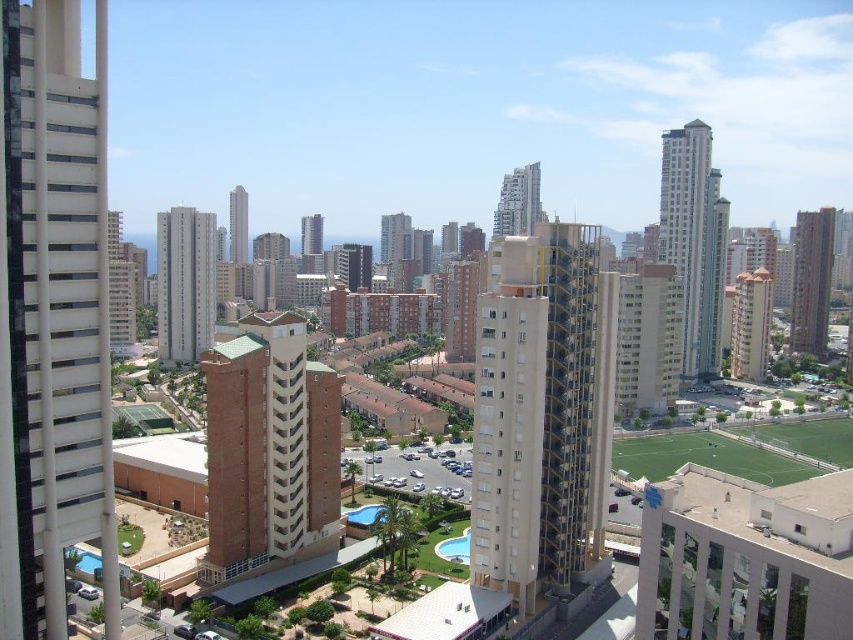
Is white textured building at left smaller than blue glass pool at center?

Incorrect, white textured building at left is not smaller in size than blue glass pool at center.

Between point (28, 321) and point (375, 520), which one is positioned in front?

Positioned in front is point (28, 321).

Who is more forward, (4, 10) or (387, 508)?

Point (4, 10) is more forward.

The width and height of the screenshot is (853, 640). What are the coordinates of `white textured building at left` in the screenshot? It's located at (x=51, y=316).

Is white textured building at left bigger than brick textured building at center?

Actually, white textured building at left might be smaller than brick textured building at center.

In the scene shown: Is white textured building at left in front of brick textured building at center?

Yes.

Is point (24, 38) more distant than point (239, 234)?

No, (24, 38) is closer to viewer.

This screenshot has width=853, height=640. What are the coordinates of `white textured building at left` in the screenshot? It's located at (51, 316).

Can you confirm if beige textured building at center is taller than light brown brick building at left?

Incorrect, beige textured building at center's height is not larger of light brown brick building at left's.

Between beige textured building at center and light brown brick building at left, which one is positioned lower?

beige textured building at center is below.

Describe the element at coordinates (543, 413) in the screenshot. I see `beige textured building at center` at that location.

Locate an element on the screen. beige textured building at center is located at coordinates (543, 413).